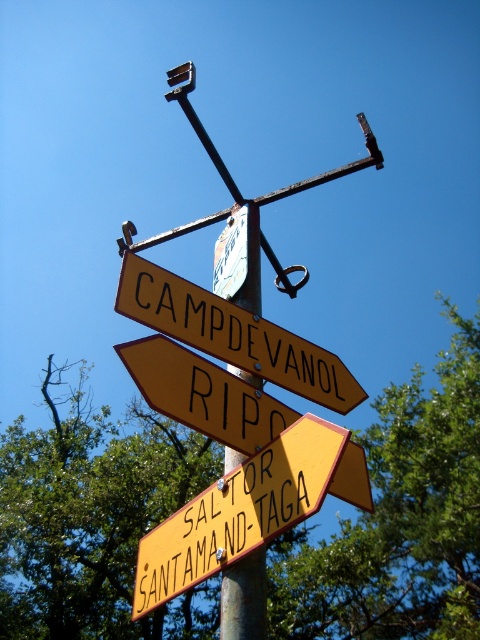
Who is positioned more to the left, yellow painted wood sign at lower right or yellow matte signpost at center?

yellow matte signpost at center

Between yellow painted wood sign at lower right and yellow matte signpost at center, which one has more height?

Standing taller between the two is yellow painted wood sign at lower right.

Is point (175, 518) behind point (363, 458)?

No, it is in front of (363, 458).

This screenshot has height=640, width=480. Identify the location of yellow painted wood sign at lower right. (239, 512).

Looking at this image, does green leafy tree at upper center appear under yellow matte signpost at upper center?

Yes.

Is point (94, 605) positioned behind point (191, 292)?

Yes.

Identify the location of green leafy tree at upper center. The image size is (480, 640). pos(398,520).

Is green leafy tree at upper center further to the viewer compared to yellow matte signpost at center?

Yes, green leafy tree at upper center is behind yellow matte signpost at center.

Is point (72, 499) more distant than point (360, 481)?

That is True.

The image size is (480, 640). In order to click on green leafy tree at upper center in this screenshot , I will do `click(398, 520)`.